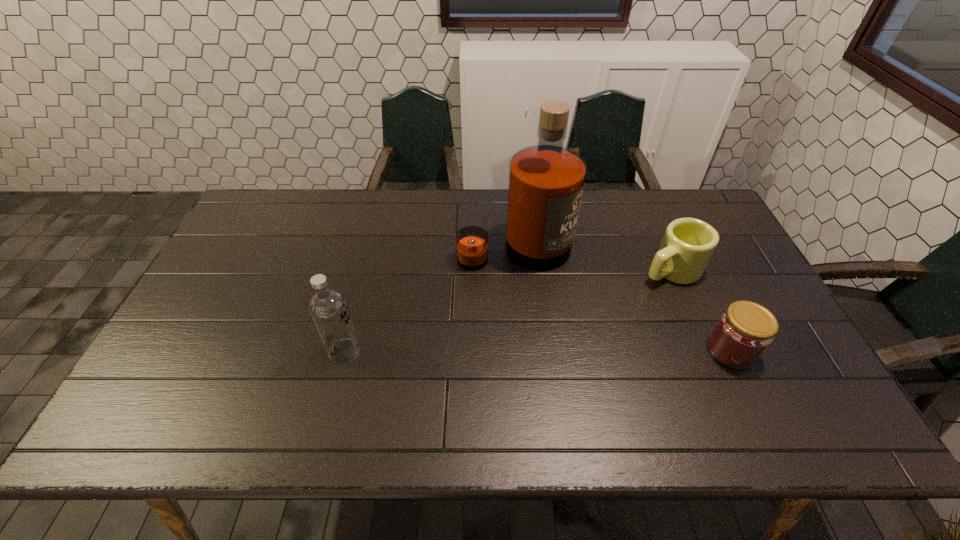
Locate an element on the screen. vacant region between the vodka and the tallest object is located at coordinates (429, 300).

The image size is (960, 540). In order to click on vacant point located between the jam and the mug in this screenshot , I will do `click(701, 310)`.

Identify the location of unoccupied position between the vodka and the mug. (508, 310).

Where is `the closest object to the jam`? This screenshot has width=960, height=540. the closest object to the jam is located at coordinates (688, 244).

Where is `the second closest object to the jam`? the second closest object to the jam is located at coordinates (546, 181).

Locate an element on the screen. The height and width of the screenshot is (540, 960). free point that satisfies the following two spatial constraints: 1. on the front side of the third object from right to left; 2. on the right side of the mug is located at coordinates (516, 269).